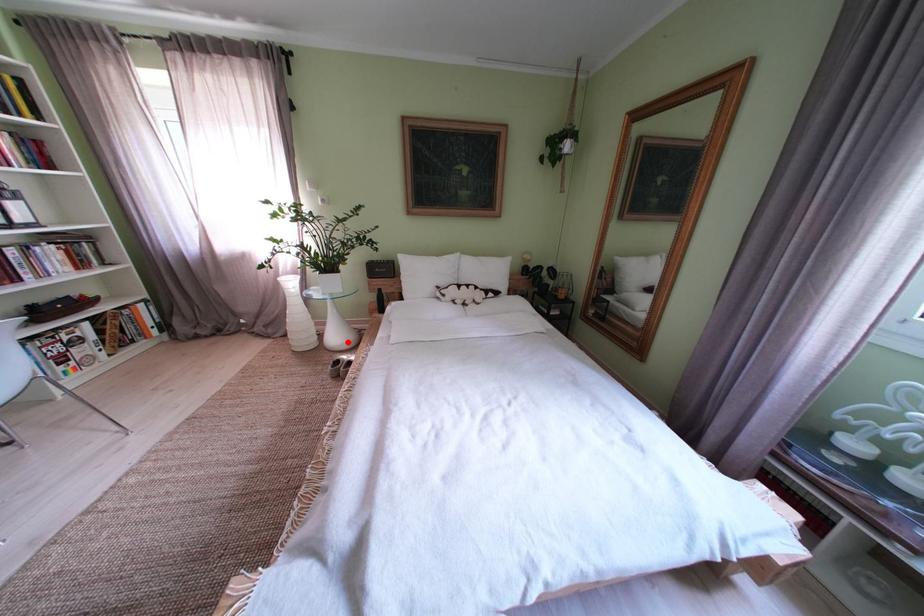
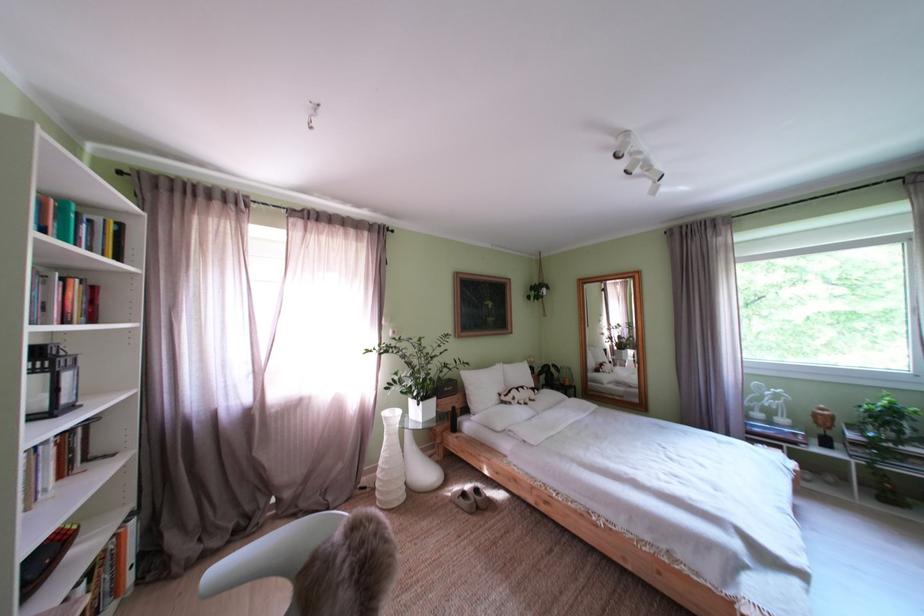
Question: I am providing you with two images of the same scene from different viewpoints. In image1, a red point is highlighted. Considering the same 3D point in image2, which of the following is correct?

Choices:
 (A) It is closer
 (B) It is farther

Answer: (A)